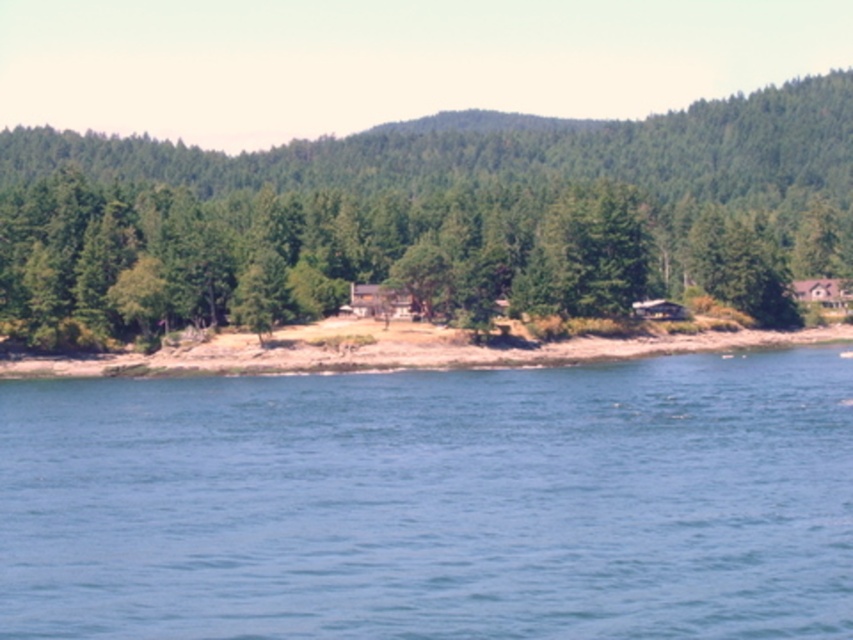
The height and width of the screenshot is (640, 853). Describe the element at coordinates (434, 502) in the screenshot. I see `blue water at lower center` at that location.

Is point (202, 381) farther from viewer compared to point (113, 179)?

No, it is not.

At what (x,y) coordinates should I click in order to perform the action: click on blue water at lower center. Please return your answer as a coordinate pair (x, y). The width and height of the screenshot is (853, 640). Looking at the image, I should click on (434, 502).

Locate an element on the screen. blue water at lower center is located at coordinates (434, 502).

Does blue water at lower center have a smaller size compared to brown sandy shoreline at center?

Correct, blue water at lower center occupies less space than brown sandy shoreline at center.

Is point (764, 378) in front of point (788, 339)?

Yes, it is in front of point (788, 339).

Locate an element on the screen. blue water at lower center is located at coordinates (434, 502).

Is green matte tree at center shorter than brown sandy shoreline at center?

Incorrect, green matte tree at center's height does not fall short of brown sandy shoreline at center's.

Is green matte tree at center further to the viewer compared to brown sandy shoreline at center?

That is True.

Is point (692, 260) in front of point (204, 358)?

No, (692, 260) is further to viewer.

I want to click on green matte tree at center, so click(433, 216).